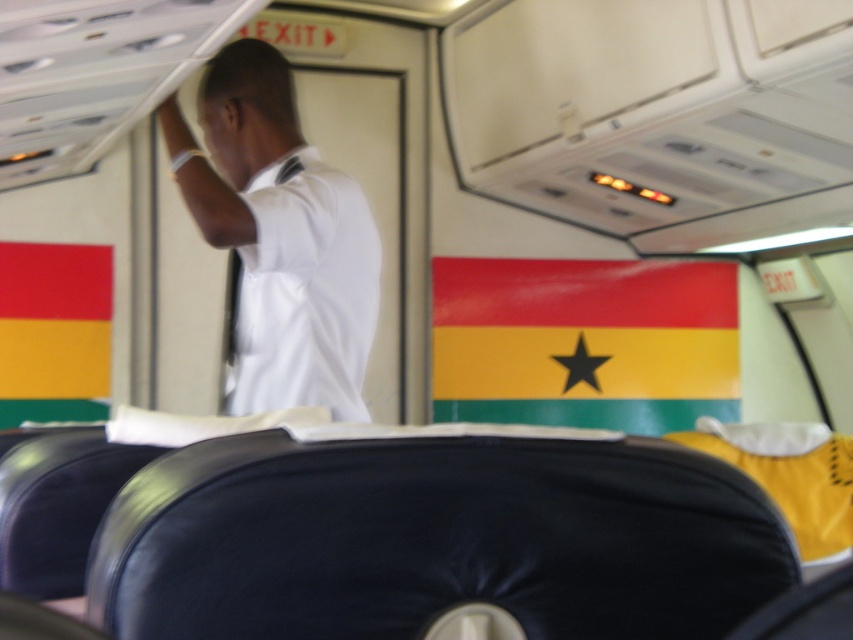
Is white shirt at upper center shorter than shiny plastic flag at center?

Correct, white shirt at upper center is not as tall as shiny plastic flag at center.

Looking at this image, is white shirt at upper center taller than shiny plastic flag at center?

No, white shirt at upper center is not taller than shiny plastic flag at center.

Is point (358, 316) less distant than point (701, 346)?

That is True.

This screenshot has width=853, height=640. Find the location of `white shirt at upper center`. white shirt at upper center is located at coordinates (277, 237).